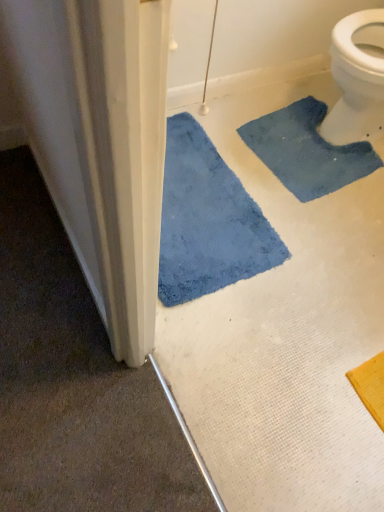
Question: Is blue plush bath mat at lower left, which is counted as the first bath mat, starting from the left, positioned with its back to blue fuzzy bath mat at upper right, the first bath mat from the right?

Choices:
 (A) yes
 (B) no

Answer: (A)

Question: Can you confirm if blue plush bath mat at lower left, which is counted as the first bath mat, starting from the left, is positioned to the left of blue fuzzy bath mat at upper right, the first bath mat from the right?

Choices:
 (A) no
 (B) yes

Answer: (B)

Question: Can you see blue plush bath mat at lower left, which is counted as the first bath mat, starting from the left, touching blue fuzzy bath mat at upper right, the second bath mat in the left-to-right sequence?

Choices:
 (A) no
 (B) yes

Answer: (A)

Question: From a real-world perspective, is blue plush bath mat at lower left, which is counted as the first bath mat, starting from the left, physically below blue fuzzy bath mat at upper right, the second bath mat in the left-to-right sequence?

Choices:
 (A) no
 (B) yes

Answer: (A)

Question: Can you confirm if blue plush bath mat at lower left, which is counted as the first bath mat, starting from the left, is bigger than blue fuzzy bath mat at upper right, the first bath mat from the right?

Choices:
 (A) yes
 (B) no

Answer: (A)

Question: Can you confirm if blue plush bath mat at lower left, which is counted as the first bath mat, starting from the left, is smaller than blue fuzzy bath mat at upper right, the first bath mat from the right?

Choices:
 (A) yes
 (B) no

Answer: (B)

Question: Does blue fuzzy bath mat at upper right, the second bath mat in the left-to-right sequence, have a greater height compared to blue plush bath mat at lower left, which is counted as the first bath mat, starting from the left?

Choices:
 (A) no
 (B) yes

Answer: (A)

Question: Is blue fuzzy bath mat at upper right, the first bath mat from the right, looking in the opposite direction of blue plush bath mat at lower left, which ranks as the second bath mat in right-to-left order?

Choices:
 (A) no
 (B) yes

Answer: (A)

Question: Is blue fuzzy bath mat at upper right, the second bath mat in the left-to-right sequence, not within blue plush bath mat at lower left, which is counted as the first bath mat, starting from the left?

Choices:
 (A) yes
 (B) no

Answer: (A)

Question: Is blue fuzzy bath mat at upper right, the first bath mat from the right, touching blue plush bath mat at lower left, which is counted as the first bath mat, starting from the left?

Choices:
 (A) no
 (B) yes

Answer: (A)

Question: Considering the relative positions of blue fuzzy bath mat at upper right, the second bath mat in the left-to-right sequence, and blue plush bath mat at lower left, which is counted as the first bath mat, starting from the left, in the image provided, is blue fuzzy bath mat at upper right, the second bath mat in the left-to-right sequence, in front of blue plush bath mat at lower left, which is counted as the first bath mat, starting from the left,?

Choices:
 (A) yes
 (B) no

Answer: (B)

Question: Is blue fuzzy bath mat at upper right, the second bath mat in the left-to-right sequence, at the left side of blue plush bath mat at lower left, which is counted as the first bath mat, starting from the left?

Choices:
 (A) yes
 (B) no

Answer: (B)

Question: From their relative heights in the image, would you say blue plush bath mat at lower left, which is counted as the first bath mat, starting from the left, is taller or shorter than blue fuzzy bath mat at upper right, the first bath mat from the right?

Choices:
 (A) tall
 (B) short

Answer: (A)